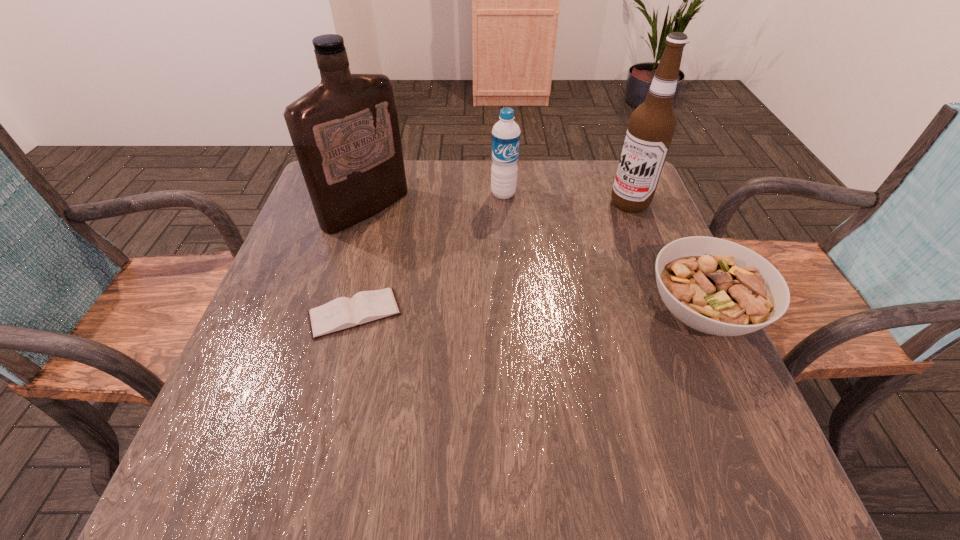
The height and width of the screenshot is (540, 960). I want to click on vacant area located 0.100m on the label of the third object from left to right, so click(507, 225).

Where is `free space located on the label side of the liquor`? The width and height of the screenshot is (960, 540). free space located on the label side of the liquor is located at coordinates (506, 309).

Identify the location of free location located on the label side of the liquor. (416, 245).

The height and width of the screenshot is (540, 960). I want to click on free point located on the label side of the liquor, so click(x=475, y=287).

What are the coordinates of `free space located 0.120m on the label of the alcohol` in the screenshot? It's located at (593, 234).

The width and height of the screenshot is (960, 540). In order to click on free region located on the label of the alcohol in this screenshot , I will do `click(539, 280)`.

At what (x,y) coordinates should I click in order to perform the action: click on vacant space situated on the label of the alcohol. Please return your answer as a coordinate pair (x, y). Looking at the image, I should click on (533, 285).

At what (x,y) coordinates should I click in order to perform the action: click on water bottle present at the far edge. Please return your answer as a coordinate pair (x, y). The width and height of the screenshot is (960, 540). Looking at the image, I should click on (505, 142).

This screenshot has width=960, height=540. Identify the location of liquor that is at the far edge. (345, 131).

I want to click on alcohol that is at the far edge, so click(x=652, y=125).